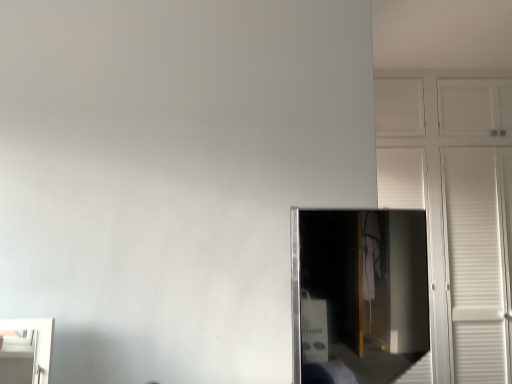
Describe the element at coordinates (358, 293) in the screenshot. This screenshot has width=512, height=384. I see `smooth silver mirror at center` at that location.

Based on the photo, measure the distance between smooth silver mirror at center and camera.

3.75 meters.

Locate an element on the screen. The image size is (512, 384). smooth silver mirror at center is located at coordinates coord(358,293).

Locate an element on the screen. Image resolution: width=512 pixels, height=384 pixels. smooth silver mirror at center is located at coordinates (358, 293).